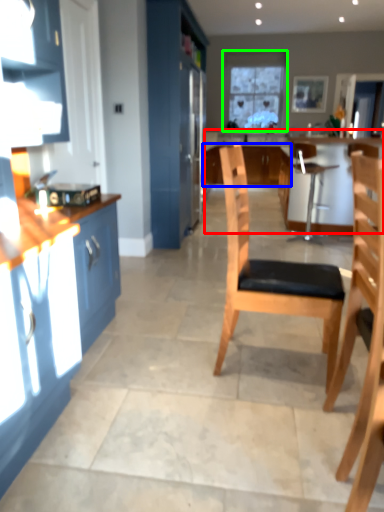
Question: Which object is the farthest from counter (highlighted by a red box)? Choose among these: cabinetry (highlighted by a blue box) or window (highlighted by a green box).

Choices:
 (A) cabinetry
 (B) window

Answer: (B)